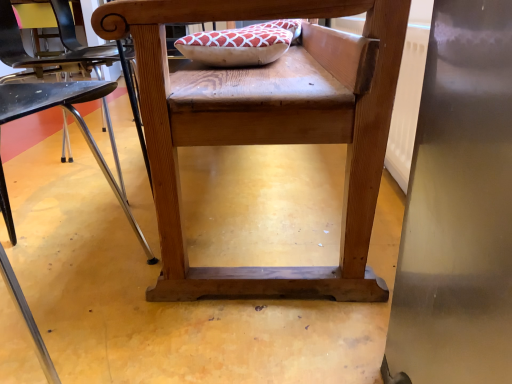
Locate an element on the screen. This screenshot has height=384, width=512. free region under wooden chair at center, the 2th chair in the right-to-left sequence (from a real-world perspective) is located at coordinates (57, 305).